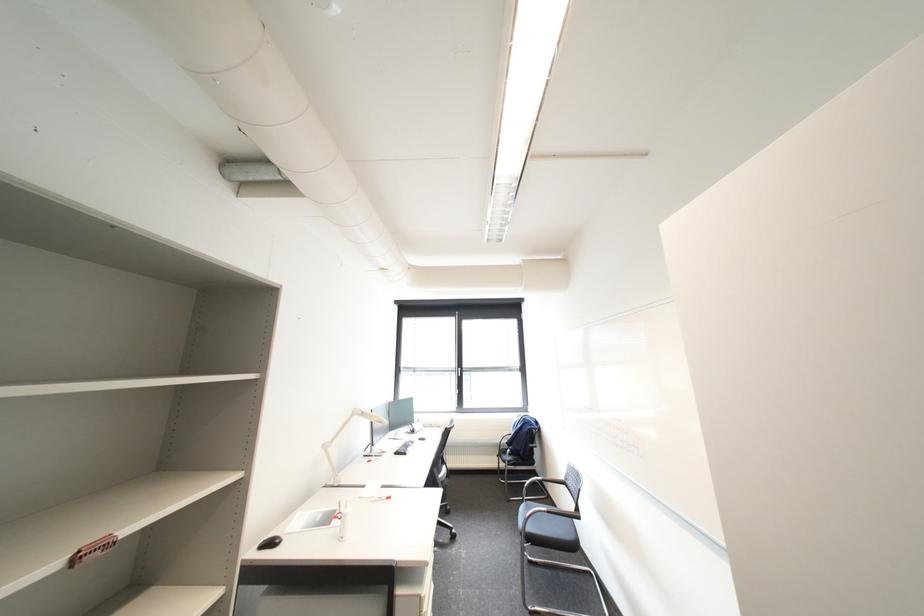
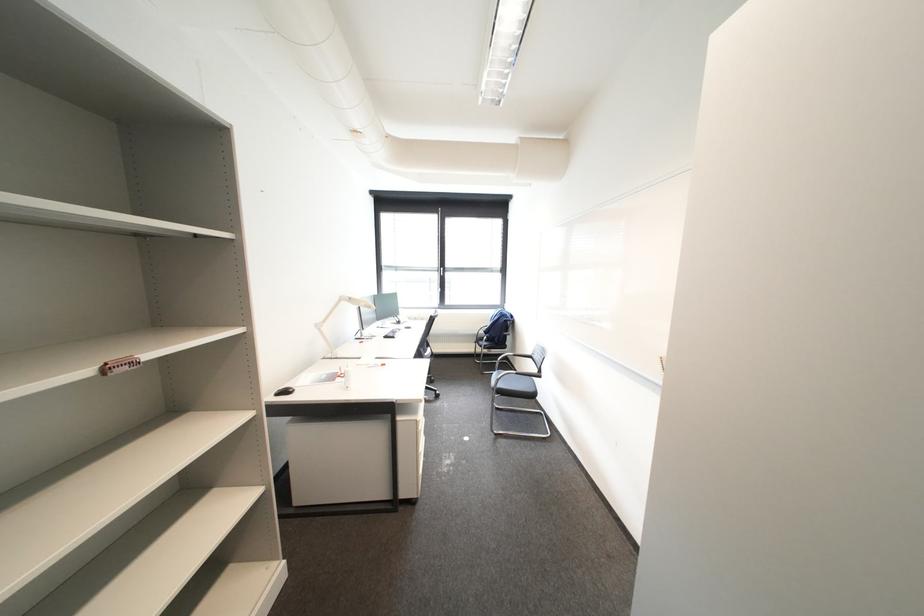
Which direction would the cameraman need to move to produce the second image?

The movement direction of the cameraman is left, backward.